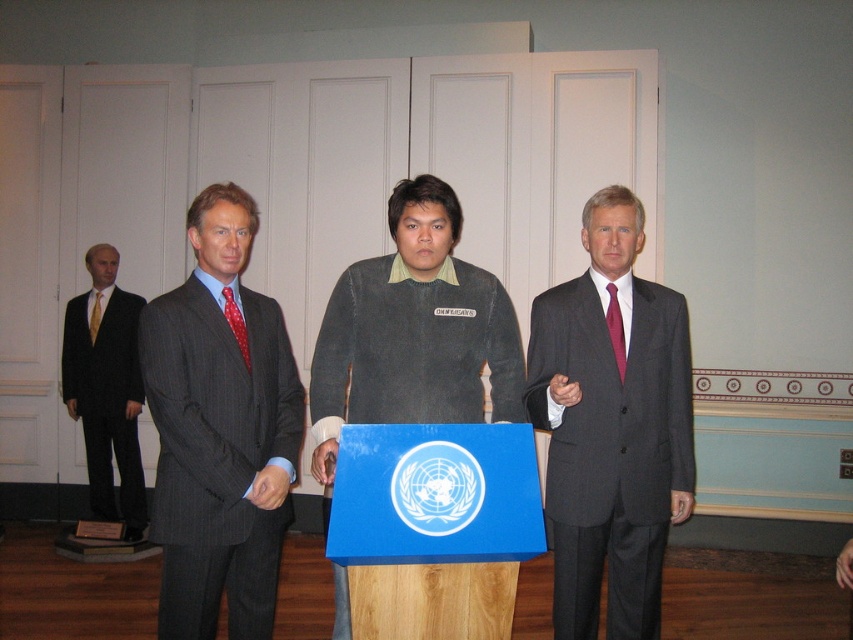
Question: Can you confirm if matte gray suit at center is positioned below gray pinstripe suit at center?

Choices:
 (A) yes
 (B) no

Answer: (A)

Question: Which object is the farthest from the matte black suit at left?

Choices:
 (A) gray pinstripe suit at center
 (B) matte gray suit at center

Answer: (B)

Question: Which point is farther from the camera taking this photo?

Choices:
 (A) (225, 285)
 (B) (363, 355)

Answer: (B)

Question: Estimate the real-world distances between objects in this image. Which object is farther from the dark gray sweater at center?

Choices:
 (A) red silk tie at center
 (B) gray pinstripe suit at center
 (C) matte black suit at left

Answer: (C)

Question: Can you confirm if matte gray suit at center is wider than dark gray sweater at center?

Choices:
 (A) yes
 (B) no

Answer: (B)

Question: Does dark gray sweater at center have a larger size compared to red silk tie at center?

Choices:
 (A) yes
 (B) no

Answer: (A)